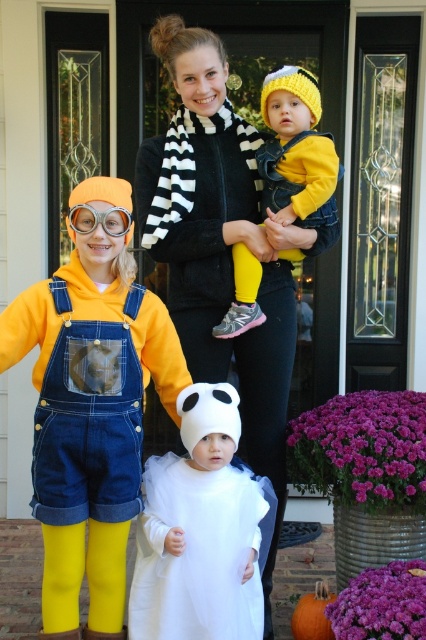
You are a photographer standing at a certain distance from the black and white striped scarf at center. If you want to take a clear photo of it without any blur, what is the minimum distance you should be from the scarf?

The minimum distance you should be from the black and white striped scarf at center is 3.13 meters to ensure a clear photo without blur.

You are a photographer trying to capture a photo of the black and white striped scarf at center and the yellow knit hat at center. The camera you are using has a minimum focusing distance of 8 inches. Can you take a clear photo of both objects without moving the camera?

The distance between the black and white striped scarf at center and the yellow knit hat at center is 9.02 inches, which is greater than the camera minimum focusing distance of 8 inches. Therefore, the camera can focus on both objects and take a clear photo without moving.

You are a photographer trying to capture a group photo of the family. The white sheer dress at center and the clear plastic goggles at left are both in the frame. Considering their sizes, which object will appear larger in the photo?

The white sheer dress at center will appear larger in the photo because its width is larger than the clear plastic goggles at left.